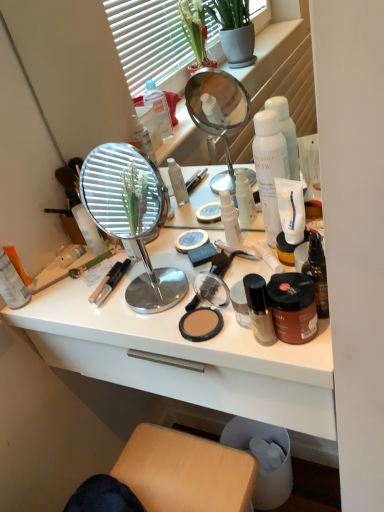
The width and height of the screenshot is (384, 512). In order to click on free area in between matte black brush at lower left and white matte spray can at center right, which is the second product in bottom-to-top order in this screenshot , I will do `click(142, 264)`.